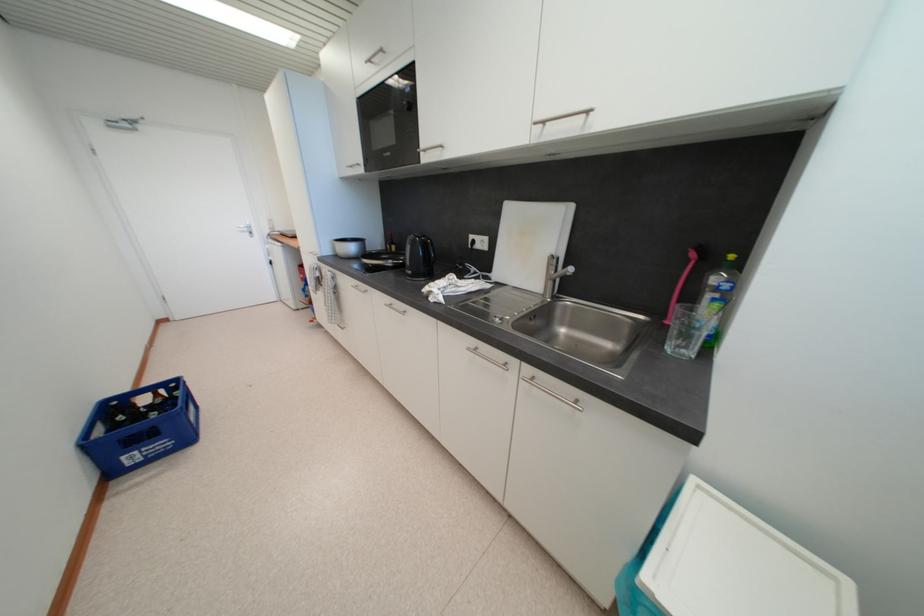
Where is `silver door handle`? The image size is (924, 616). silver door handle is located at coordinates (246, 228).